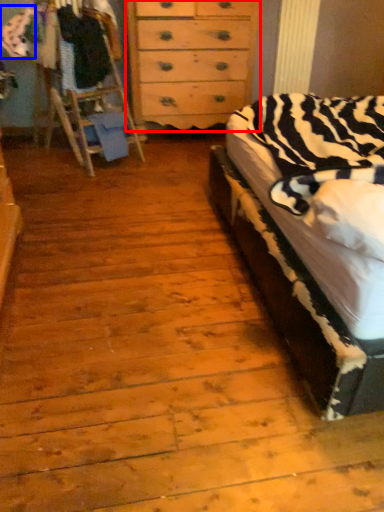
Question: Which of the following is the closest to the observer, chest of drawers (highlighted by a red box) or clothing (highlighted by a blue box)?

Choices:
 (A) chest of drawers
 (B) clothing

Answer: (B)